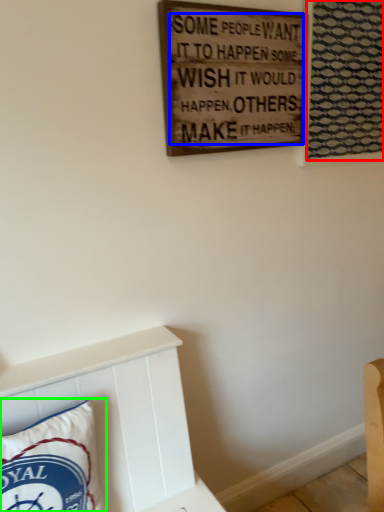
Question: Which object is the closest to the tapestry (highlighted by a red box)? Choose among these: writing (highlighted by a blue box) or pillow (highlighted by a green box).

Choices:
 (A) writing
 (B) pillow

Answer: (A)